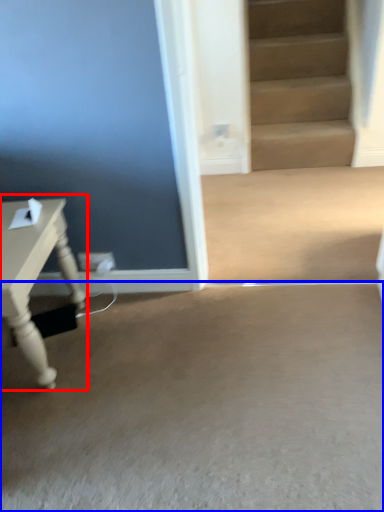
Question: Which of the following is the farthest to the observer, table (highlighted by a red box) or concrete (highlighted by a blue box)?

Choices:
 (A) table
 (B) concrete

Answer: (A)